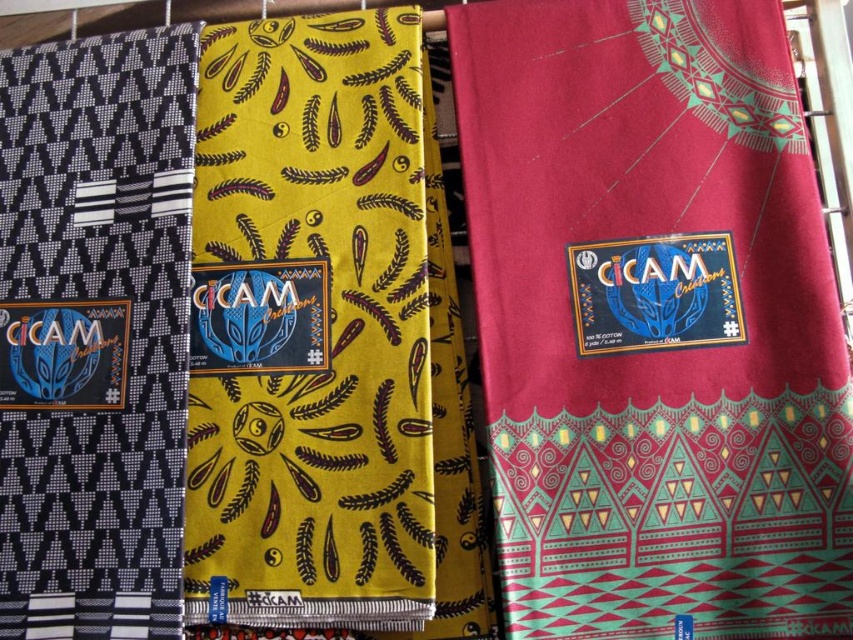
You are an interior designer looking at the middle fabric. There are two points marked on it. The first point is at coordinates point (254, 54) and the second at point (27, 144). Which point is closer to the viewer?

Point (27, 144) is closer to the viewer because it is in front of point (254, 54).

You are an interior designer examining the middle fabric. You notice two points marked on it. Which point is closer to you, point [482,241] or point [165,221]?

Point [482,241] is closer to the viewer than point [165,221].